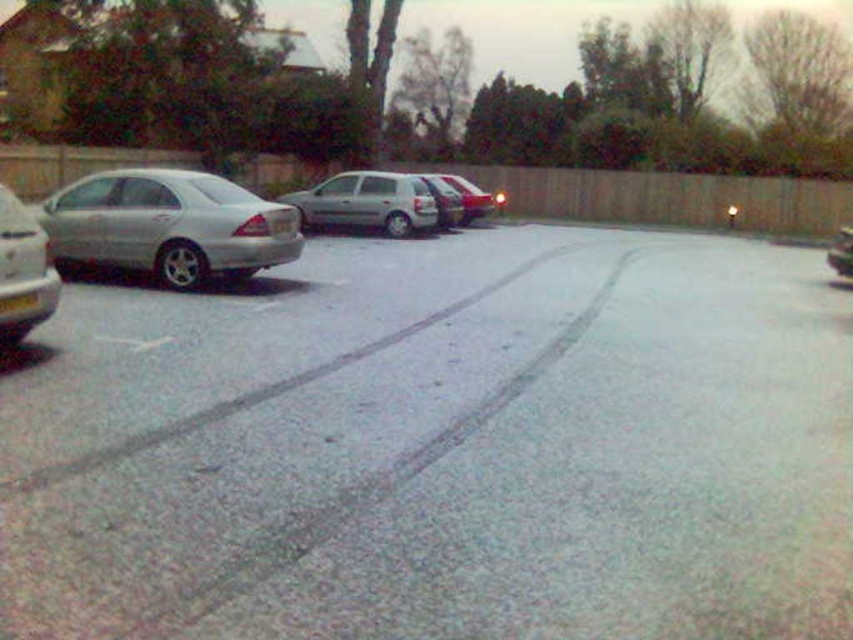
In the scene shown: You are a delivery person trying to park your van behind the satin silver hatchback at center and the silver metallic sedan at left. Since your van is 6 feet tall, can you fit through the space between them without hitting the top?

The satin silver hatchback at center is taller than the silver metallic sedan at left. Since the hatchback is taller, the available vertical space between them would depend on the height of the hatchback. However, without knowing the exact height of the hatchback, it is impossible to determine if your 6 feet tall van can fit. You should measure the clearance or choose a different parking spot.

You are a delivery person trying to park your van in the driveway. You see the satin silver hatchback at center and the satin silver sedan at center. Which car should you move to make space for your van?

You should move the satin silver hatchback at center because it is positioned on the left side of the satin silver sedan at center, so moving it would create more space for your van.

Based on the scene description, can you determine if the point at coordinates (440, 448) is located on the silver metallic car at left?

Yes, the point at coordinates (440, 448) is located on the silver metallic car at left.